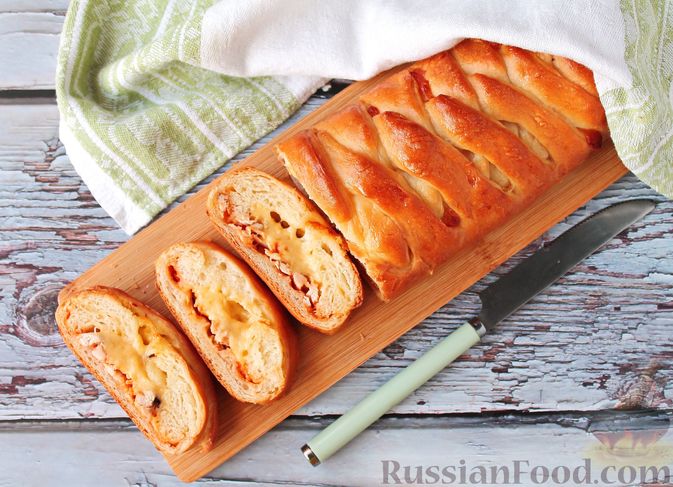
Image resolution: width=673 pixels, height=487 pixels. I want to click on empty space on table, so click(x=602, y=332).